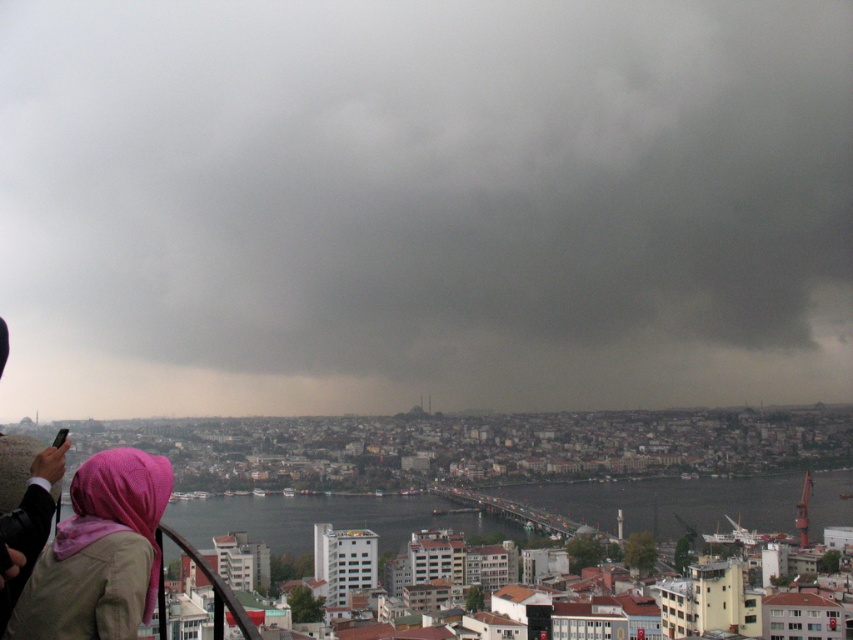
Between dark gray cloud at upper center and pink fabric headscarf at lower left, which one is positioned higher?

dark gray cloud at upper center

Is dark gray cloud at upper center smaller than pink fabric headscarf at lower left?

No, dark gray cloud at upper center is not smaller than pink fabric headscarf at lower left.

Between point (631, 307) and point (45, 573), which one is positioned behind?

The point (631, 307) is behind.

Identify the location of dark gray cloud at upper center. The height and width of the screenshot is (640, 853). (422, 205).